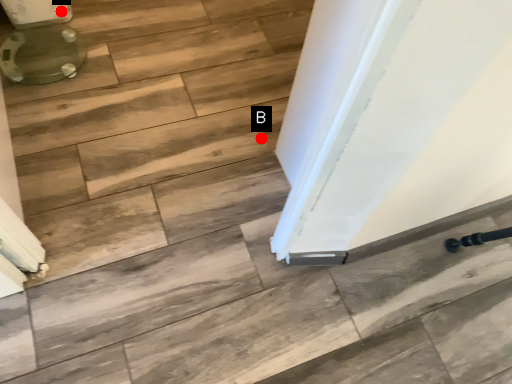
Question: Two points are circled on the image, labeled by A and B beside each circle. Which of the following is the farthest from the observer?

Choices:
 (A) A is further
 (B) B is further

Answer: (A)